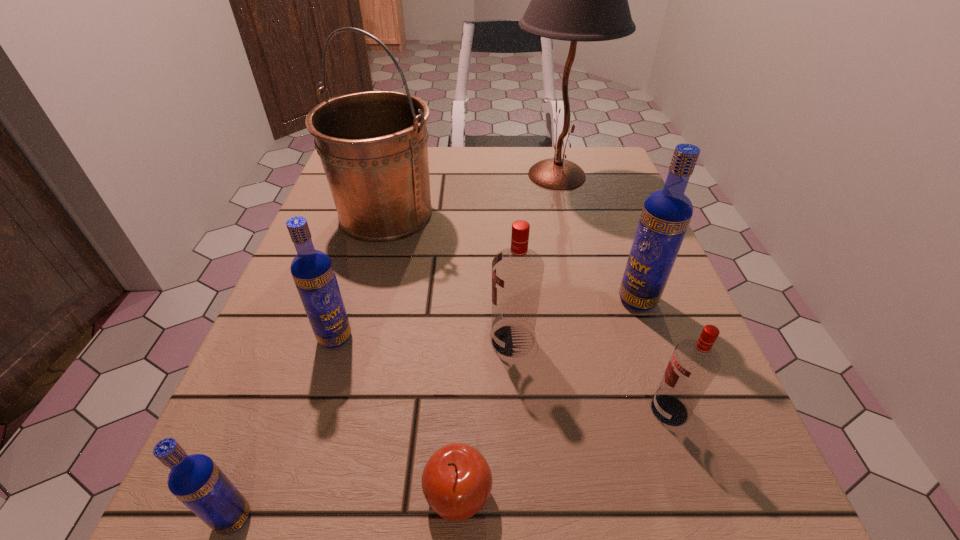
You are a GUI agent. You are given a task and a screenshot of the screen. Output one action in this format:
    pyautogui.click(x=<x>, y=<y>)
    Task: Click on the vodka that is at the near edge
    This screenshot has height=540, width=960.
    Given the screenshot: What is the action you would take?
    pyautogui.click(x=195, y=480)

Find the location of a particular element. apple at the near edge is located at coordinates (457, 481).

This screenshot has height=540, width=960. I want to click on bucket that is at the left edge, so click(x=373, y=146).

Where is `table lamp at the right edge`? The height and width of the screenshot is (540, 960). table lamp at the right edge is located at coordinates (585, 0).

Where is `object located at the far left corner`? object located at the far left corner is located at coordinates (373, 146).

Locate an element on the screen. This screenshot has width=960, height=540. object located at the near left corner is located at coordinates (x=195, y=480).

I want to click on object that is positioned at the far right corner, so click(585, 0).

Find the location of a particular element. The width and height of the screenshot is (960, 540). vacant space at the far edge of the desktop is located at coordinates (463, 190).

Locate an element on the screen. free space at the near edge is located at coordinates (514, 517).

At what (x,y) coordinates should I click in order to perform the action: click on vacant space at the right edge of the desktop. Please return your answer as a coordinate pair (x, y). The height and width of the screenshot is (540, 960). Looking at the image, I should click on (680, 291).